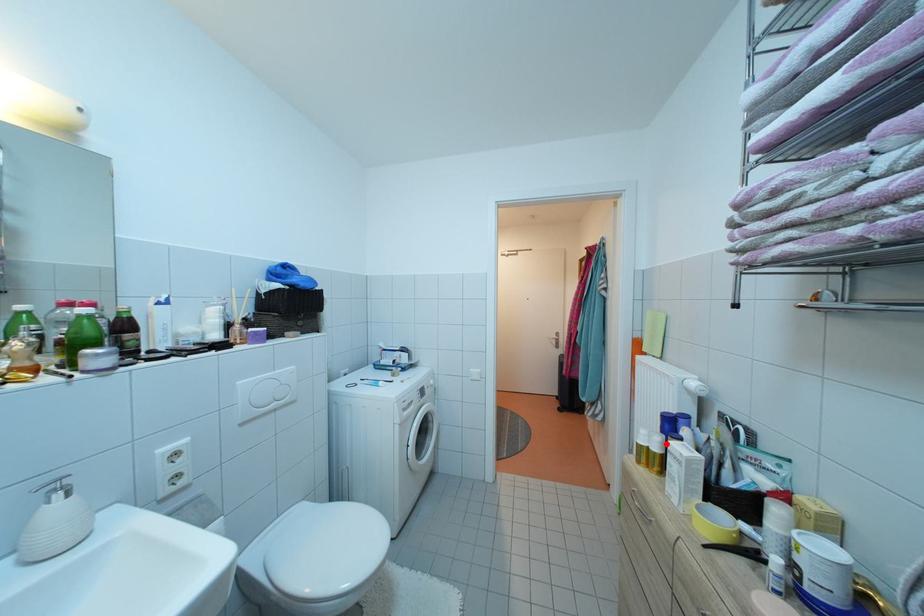
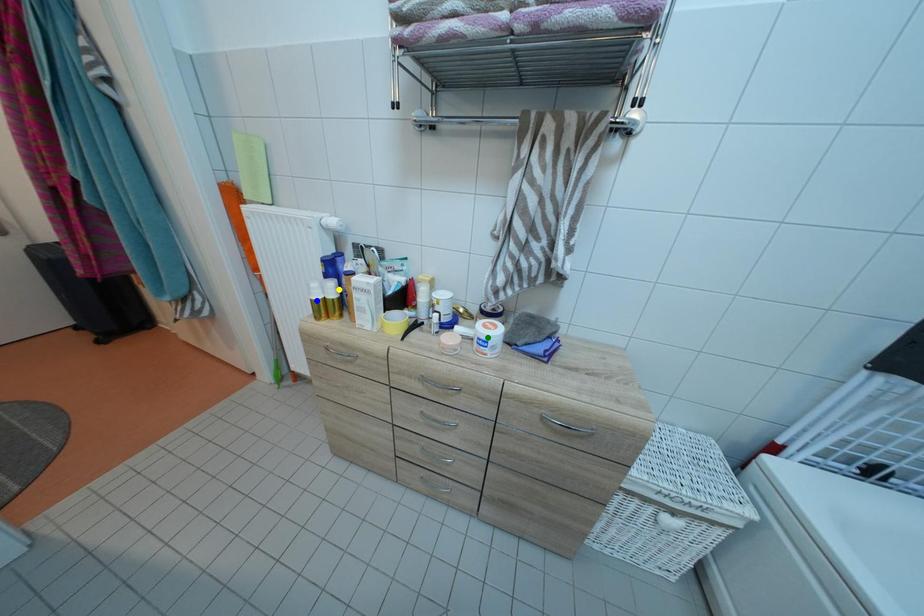
Question: I am providing you with two images of the same scene from different viewpoints. A red point is marked on the first image. You are given multiple points on the second image. Can you choose the point in image 2 that corresponds to the point in image 1?

Choices:
 (A) blue point
 (B) yellow point
 (C) green point

Answer: (B)